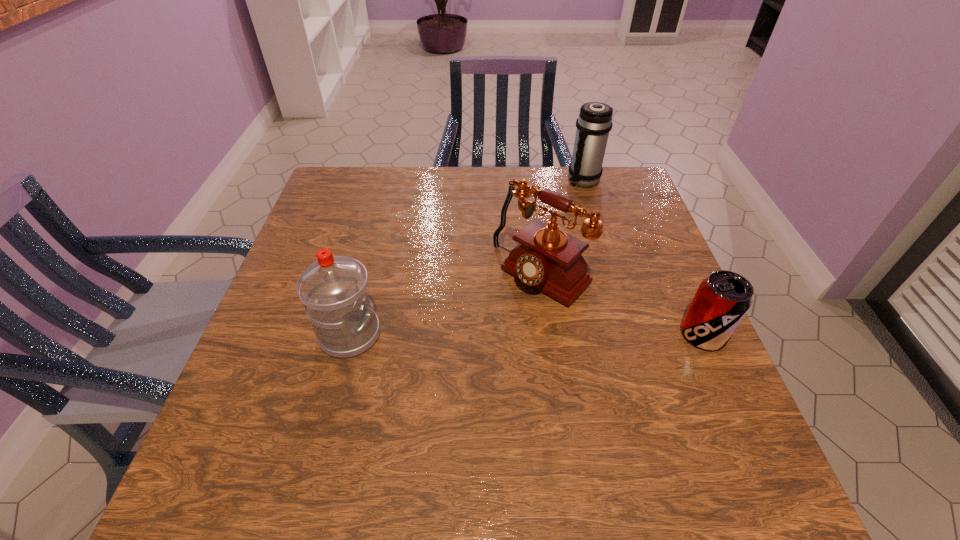
Find the location of a particular element. free point at the far edge is located at coordinates (468, 169).

You are a GUI agent. You are given a task and a screenshot of the screen. Output one action in this format:
    pyautogui.click(x=<x>, y=<y>)
    Task: Click on the blank space at the left edge of the desktop
    The width and height of the screenshot is (960, 540).
    Given the screenshot: What is the action you would take?
    pyautogui.click(x=318, y=243)

In the image, there is a desktop. At what (x,y) coordinates should I click in order to perform the action: click on vacant space at the right edge. Please return your answer as a coordinate pair (x, y). The width and height of the screenshot is (960, 540). Looking at the image, I should click on (665, 316).

The width and height of the screenshot is (960, 540). I want to click on vacant space at the far left corner of the desktop, so click(x=377, y=185).

I want to click on free location at the near left corner, so click(275, 434).

What are the coordinates of `blank space at the far right corner` in the screenshot? It's located at (634, 185).

I want to click on vacant space at the near right corner of the desktop, so click(721, 397).

Identify the location of vacant space that is in between the soda can and the second farthest object. (622, 305).

Identify the location of blank region between the second object from left to right and the leftmost object. Image resolution: width=960 pixels, height=540 pixels. (445, 305).

You are a GUI agent. You are given a task and a screenshot of the screen. Output one action in this format:
    pyautogui.click(x=<x>, y=<y>)
    Task: Click on the free space between the water bottle and the second farthest object
    This screenshot has height=540, width=960.
    Given the screenshot: What is the action you would take?
    (445, 305)